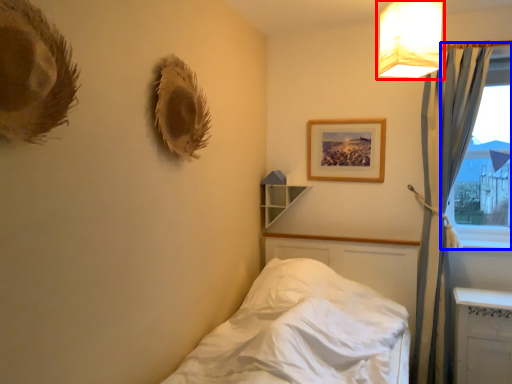
Question: Which of the following is the farthest to the observer, lamp (highlighted by a red box) or window (highlighted by a blue box)?

Choices:
 (A) lamp
 (B) window

Answer: (B)